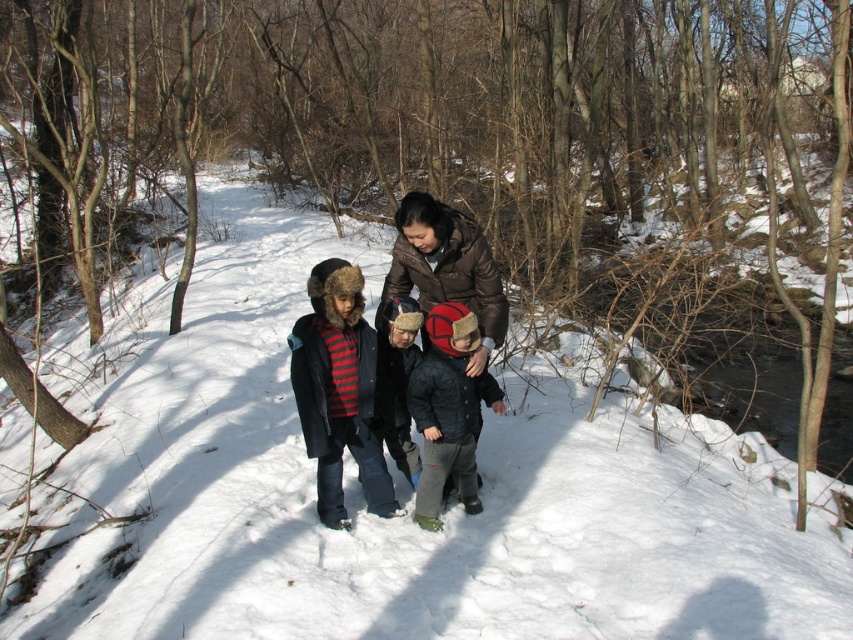
Does point (346, 525) come closer to viewer compared to point (438, 285)?

Yes.

Is dark brown fur-lined coat at center positioned at the back of brown fuzzy coat at center?

No, dark brown fur-lined coat at center is in front of brown fuzzy coat at center.

Which is in front, point (437, 259) or point (445, 292)?

Point (437, 259) is in front.

Find the location of a particular element. dark brown fur-lined coat at center is located at coordinates (444, 269).

Which is below, dark blue jacket at center or brown fuzzy coat at center?

Positioned lower is dark blue jacket at center.

Looking at this image, who is positioned more to the right, dark blue jacket at center or brown fuzzy coat at center?

dark blue jacket at center

Who is more distant from viewer, (426, 436) or (436, 301)?

The point (436, 301) is more distant.

Image resolution: width=853 pixels, height=640 pixels. Identify the location of dark blue jacket at center. (448, 410).

Who is more forward, (312, 428) or (463, 496)?

Point (312, 428) is more forward.

Where is `dark brown fur-lined coat at center`? Image resolution: width=853 pixels, height=640 pixels. dark brown fur-lined coat at center is located at coordinates (444, 269).

I want to click on dark brown fur-lined coat at center, so click(444, 269).